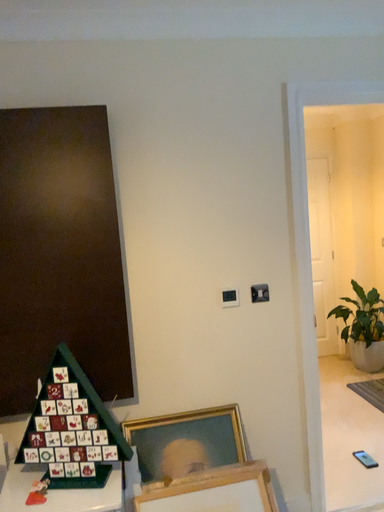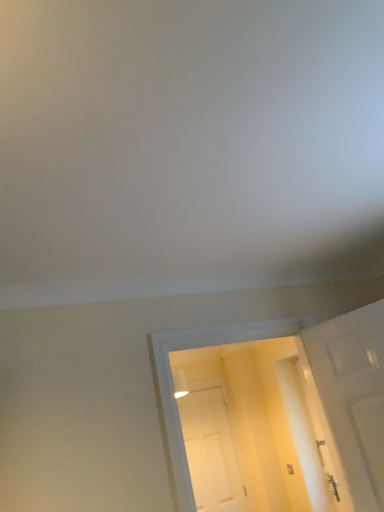
Question: How did the camera likely rotate when shooting the video?

Choices:
 (A) rotated upward
 (B) rotated downward

Answer: (A)